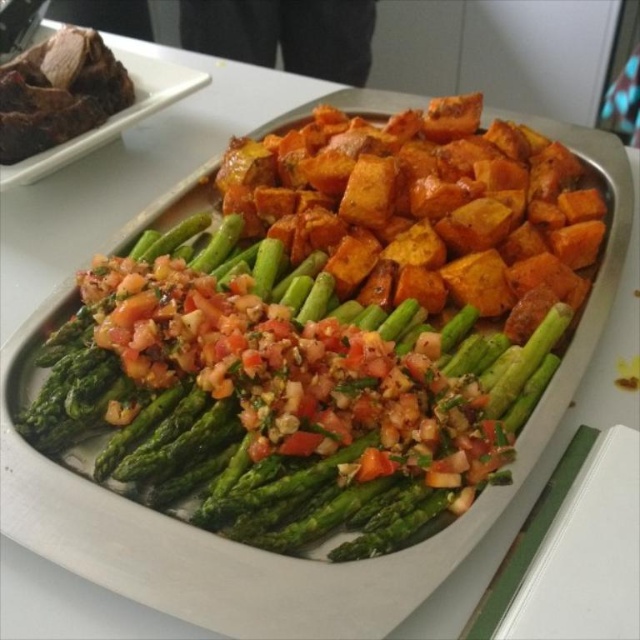
Is the position of green glossy asparagus at center less distant than that of dark brown meat at upper left?

Yes, it is.

Does point (232, 419) come farther from viewer compared to point (120, 74)?

No, (232, 419) is closer to viewer.

Is point (316, 323) farther from viewer compared to point (51, 76)?

No, (316, 323) is in front of (51, 76).

Find the location of a particular element. green glossy asparagus at center is located at coordinates (282, 400).